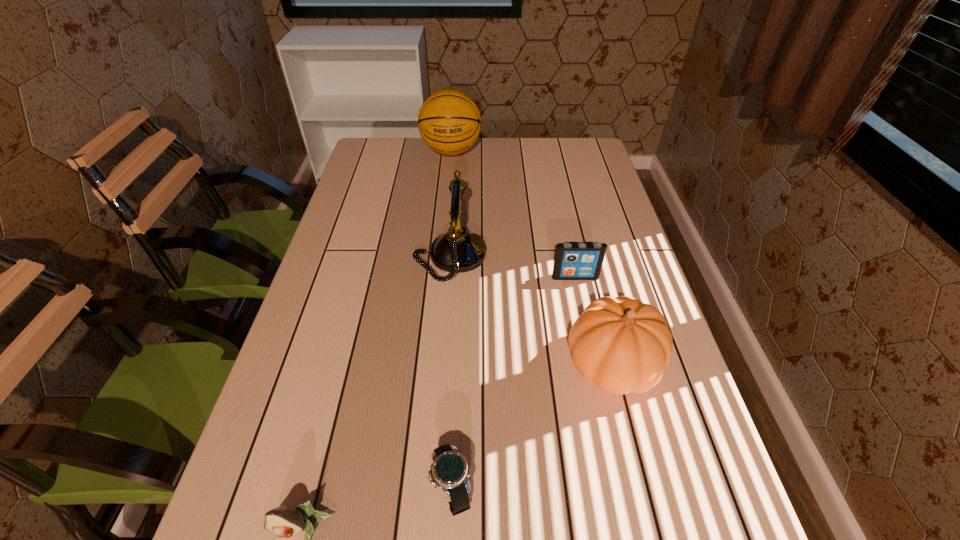
At what (x,y) coordinates should I click in order to perform the action: click on free space between the iPod and the telephone. Please return your answer as a coordinate pair (x, y). Looking at the image, I should click on (513, 267).

Image resolution: width=960 pixels, height=540 pixels. I want to click on free area in between the fourth farthest object and the basketball, so click(532, 258).

Where is `blank region between the iPod and the farthest object`? blank region between the iPod and the farthest object is located at coordinates (514, 214).

The image size is (960, 540). Find the location of `empty space between the iPod and the farthest object`. empty space between the iPod and the farthest object is located at coordinates (514, 214).

Locate an element on the screen. This screenshot has height=540, width=960. blank region between the telephone and the farthest object is located at coordinates (451, 204).

Choose which object is the fourth nearest neighbor to the avocado. Please provide its 2D coordinates. Your answer should be formatted as a tuple, i.e. [(x, y)], where the tuple contains the x and y coordinates of a point satisfying the conditions above.

[(573, 260)]

In order to click on object that stands as the fifth closest to the watch in this screenshot , I will do `click(449, 121)`.

In order to click on free space in the image that satisfies the following two spatial constraints: 1. on the dial of the pumpkin; 2. on the right side of the telephone in this screenshot , I will do `click(443, 364)`.

Locate an element on the screen. free location that satisfies the following two spatial constraints: 1. on the front screen of the iPod; 2. on the right side of the pumpkin is located at coordinates (594, 364).

The width and height of the screenshot is (960, 540). Find the location of `vacant area that satisfies the following two spatial constraints: 1. on the surface of the basketball near the brand logo; 2. on the right side of the watch`. vacant area that satisfies the following two spatial constraints: 1. on the surface of the basketball near the brand logo; 2. on the right side of the watch is located at coordinates (420, 489).